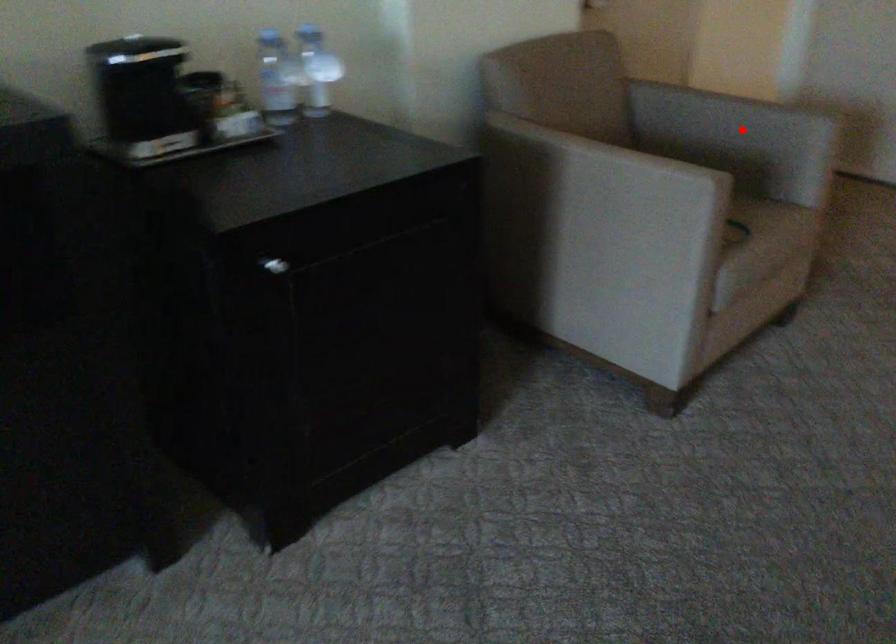
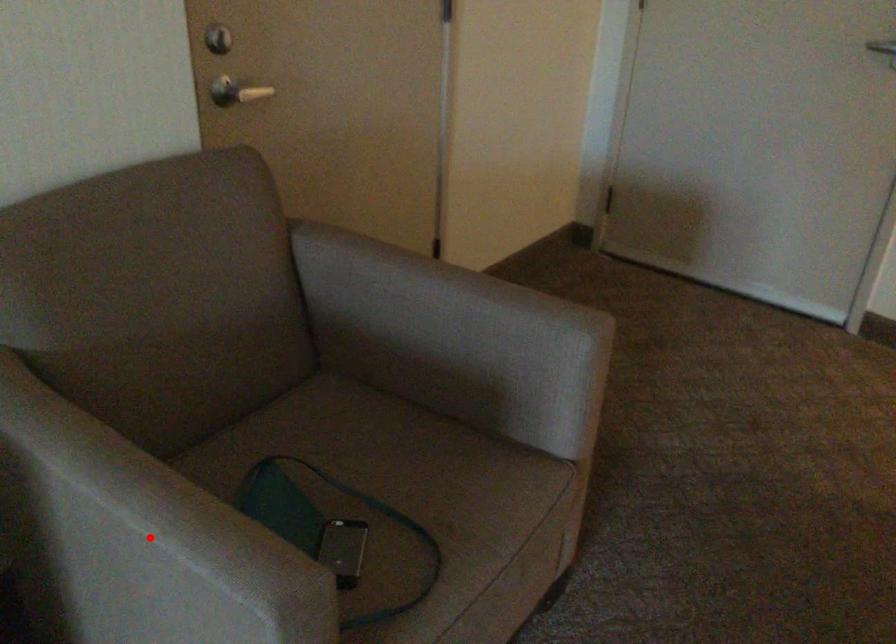
I am providing you with two images of the same scene from different viewpoints. A red point is marked on the first image and another point is marked on the second image. Does the point marked in image1 correspond to the same location as the one in image2?

No